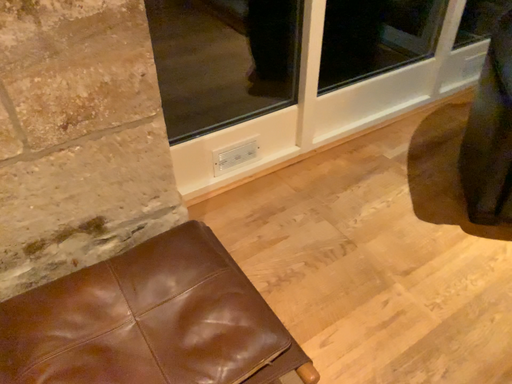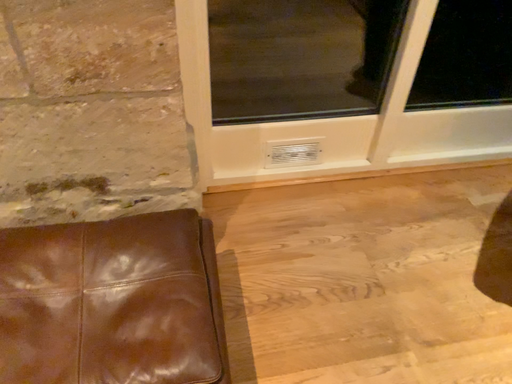
Question: How did the camera likely rotate when shooting the video?

Choices:
 (A) rotated left
 (B) rotated right

Answer: (A)